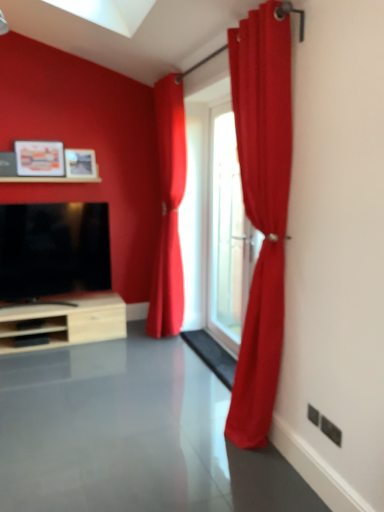
Question: Is matte wooden picture frame at upper left, which is counted as the first picture frame, starting from the left, thinner than satin red curtain at right, which is counted as the 2th curtain, starting from the back?

Choices:
 (A) yes
 (B) no

Answer: (A)

Question: Considering the relative sizes of matte wooden picture frame at upper left, which is counted as the first picture frame, starting from the left, and satin red curtain at right, which is counted as the 1th curtain, starting from the right, in the image provided, is matte wooden picture frame at upper left, which is counted as the first picture frame, starting from the left, bigger than satin red curtain at right, which is counted as the 1th curtain, starting from the right,?

Choices:
 (A) no
 (B) yes

Answer: (A)

Question: Considering the relative positions of matte wooden picture frame at upper left, the second picture frame when ordered from right to left, and satin red curtain at right, acting as the 2th curtain starting from the left, in the image provided, is matte wooden picture frame at upper left, the second picture frame when ordered from right to left, behind satin red curtain at right, acting as the 2th curtain starting from the left,?

Choices:
 (A) yes
 (B) no

Answer: (A)

Question: Could you tell me if matte wooden picture frame at upper left, the second picture frame when ordered from right to left, is facing satin red curtain at right, which is counted as the 2th curtain, starting from the back?

Choices:
 (A) no
 (B) yes

Answer: (B)

Question: Is matte wooden picture frame at upper left, the second picture frame when ordered from right to left, to the left of satin red curtain at right, acting as the 2th curtain starting from the left, from the viewer's perspective?

Choices:
 (A) yes
 (B) no

Answer: (A)

Question: Considering the relative sizes of matte wooden picture frame at upper left, which is counted as the first picture frame, starting from the left, and satin red curtain at right, acting as the 2th curtain starting from the left, in the image provided, is matte wooden picture frame at upper left, which is counted as the first picture frame, starting from the left, taller than satin red curtain at right, acting as the 2th curtain starting from the left,?

Choices:
 (A) no
 (B) yes

Answer: (A)

Question: Is satin red curtain at center, placed as the first curtain when sorted from back to front, at the back of black glossy tv at left?

Choices:
 (A) no
 (B) yes

Answer: (A)

Question: From a real-world perspective, is black glossy tv at left physically above satin red curtain at center, placed as the first curtain when sorted from back to front?

Choices:
 (A) no
 (B) yes

Answer: (A)

Question: Considering the relative sizes of black glossy tv at left and satin red curtain at center, which ranks as the second curtain in front-to-back order, in the image provided, is black glossy tv at left wider than satin red curtain at center, which ranks as the second curtain in front-to-back order,?

Choices:
 (A) yes
 (B) no

Answer: (B)

Question: Can you confirm if black glossy tv at left is shorter than satin red curtain at center, which appears as the 1th curtain when viewed from the left?

Choices:
 (A) no
 (B) yes

Answer: (B)

Question: Does black glossy tv at left have a lesser width compared to satin red curtain at center, the second curtain positioned from the right?

Choices:
 (A) no
 (B) yes

Answer: (B)

Question: Is black glossy tv at left outside of satin red curtain at center, which appears as the 1th curtain when viewed from the left?

Choices:
 (A) yes
 (B) no

Answer: (A)

Question: Does matte wooden picture frame at upper left, the second picture frame when ordered from right to left, appear on the right side of matte wooden picture frame at upper left, placed as the first picture frame when sorted from right to left?

Choices:
 (A) no
 (B) yes

Answer: (A)